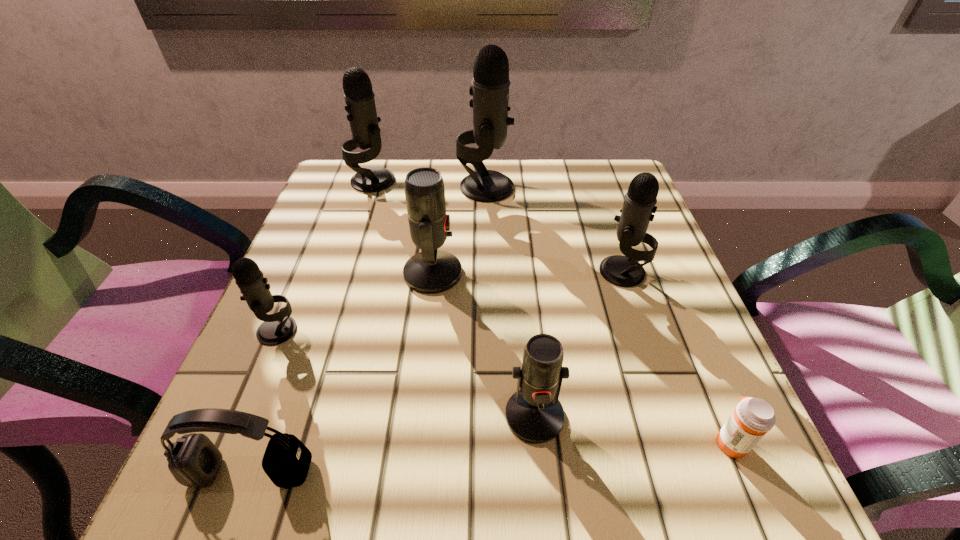
Identify the location of the nearest microphone. (533, 413).

What are the coordinates of `the right red microphone` in the screenshot? It's located at (533, 413).

This screenshot has height=540, width=960. What are the coordinates of `black headset` in the screenshot? It's located at (194, 461).

I want to click on the rightmost object, so click(753, 417).

The image size is (960, 540). Identify the location of medicine. (753, 417).

Where is `free space located 0.050m on the front of the biggest black microphone`? free space located 0.050m on the front of the biggest black microphone is located at coordinates (486, 215).

The width and height of the screenshot is (960, 540). I want to click on vacant area situated on the right of the second tallest microphone, so click(x=495, y=181).

Find the location of a particular element. vacant region located on the side of the bigger red microphone with the red ring is located at coordinates (509, 273).

Find the location of a particular element. Image resolution: width=960 pixels, height=540 pixels. vacant space situated 0.220m on the front of the third biggest black microphone is located at coordinates (662, 389).

Image resolution: width=960 pixels, height=540 pixels. Find the location of `vacant space located 0.210m on the back of the fifth farthest microphone`. vacant space located 0.210m on the back of the fifth farthest microphone is located at coordinates (316, 241).